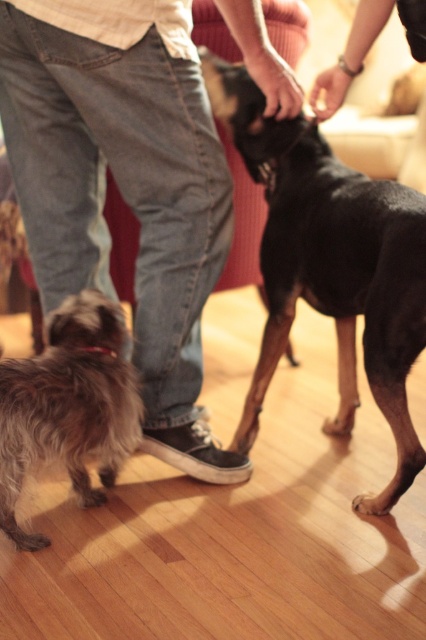
You are standing in the living room and want to place a small toy between the two points marked as point (97,243) and point (339,321). Which point should the toy be closer to in order to be nearer to the camera?

The toy should be closer to point (97,243) because it is further to the camera than point (339,321).

You are a person who wants to sit on the couch but there is a fuzzy brown dog at lower left and jeans at center in the way. Which object is blocking your path closer to the ground?

The fuzzy brown dog at lower left is closer to the ground because the jeans at center is located above it.